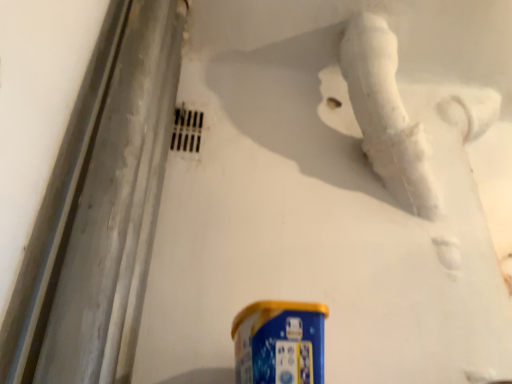
Question: From a real-world perspective, is white marble water pipe at upper right positioned under blue metallic spray can at bottom based on gravity?

Choices:
 (A) yes
 (B) no

Answer: (B)

Question: Is white marble water pipe at upper right positioned far away from blue metallic spray can at bottom?

Choices:
 (A) no
 (B) yes

Answer: (A)

Question: Is white marble water pipe at upper right not inside blue metallic spray can at bottom?

Choices:
 (A) yes
 (B) no

Answer: (A)

Question: Can you confirm if white marble water pipe at upper right is thinner than blue metallic spray can at bottom?

Choices:
 (A) yes
 (B) no

Answer: (A)

Question: From the image's perspective, is white marble water pipe at upper right above blue metallic spray can at bottom?

Choices:
 (A) yes
 (B) no

Answer: (A)

Question: Does white marble water pipe at upper right contain blue metallic spray can at bottom?

Choices:
 (A) no
 (B) yes

Answer: (A)

Question: Is blue metallic spray can at bottom closer to the viewer compared to white marble water pipe at upper right?

Choices:
 (A) no
 (B) yes

Answer: (B)

Question: Is blue metallic spray can at bottom shorter than white marble water pipe at upper right?

Choices:
 (A) no
 (B) yes

Answer: (B)

Question: From a real-world perspective, is blue metallic spray can at bottom located higher than white marble water pipe at upper right?

Choices:
 (A) yes
 (B) no

Answer: (B)

Question: Is white marble water pipe at upper right completely or partially inside blue metallic spray can at bottom?

Choices:
 (A) yes
 (B) no

Answer: (B)

Question: Considering the relative sizes of blue metallic spray can at bottom and white marble water pipe at upper right in the image provided, is blue metallic spray can at bottom smaller than white marble water pipe at upper right?

Choices:
 (A) no
 (B) yes

Answer: (B)

Question: Considering the relative positions of blue metallic spray can at bottom and white marble water pipe at upper right in the image provided, is blue metallic spray can at bottom behind white marble water pipe at upper right?

Choices:
 (A) no
 (B) yes

Answer: (A)

Question: Which is correct: white marble water pipe at upper right is inside blue metallic spray can at bottom, or outside of it?

Choices:
 (A) inside
 (B) outside

Answer: (B)